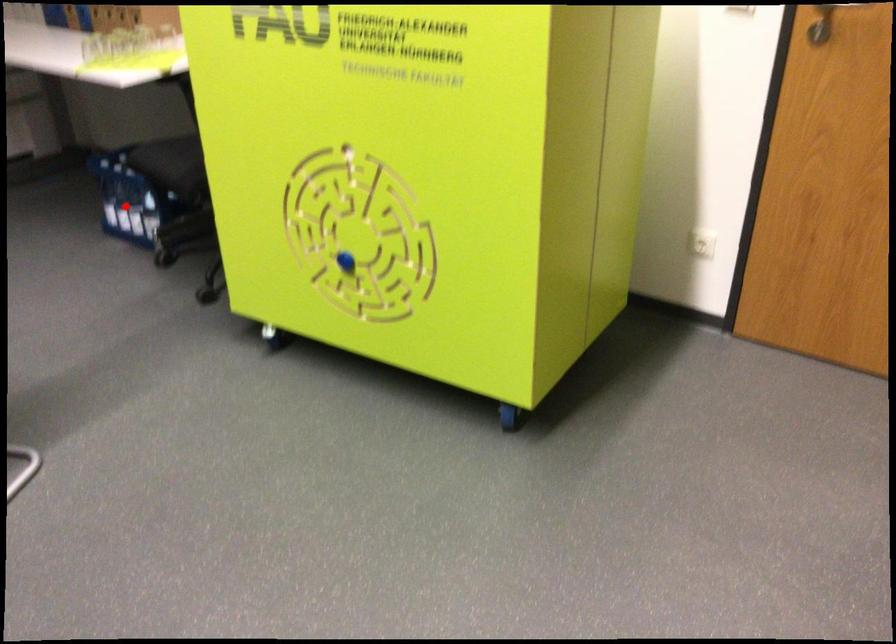
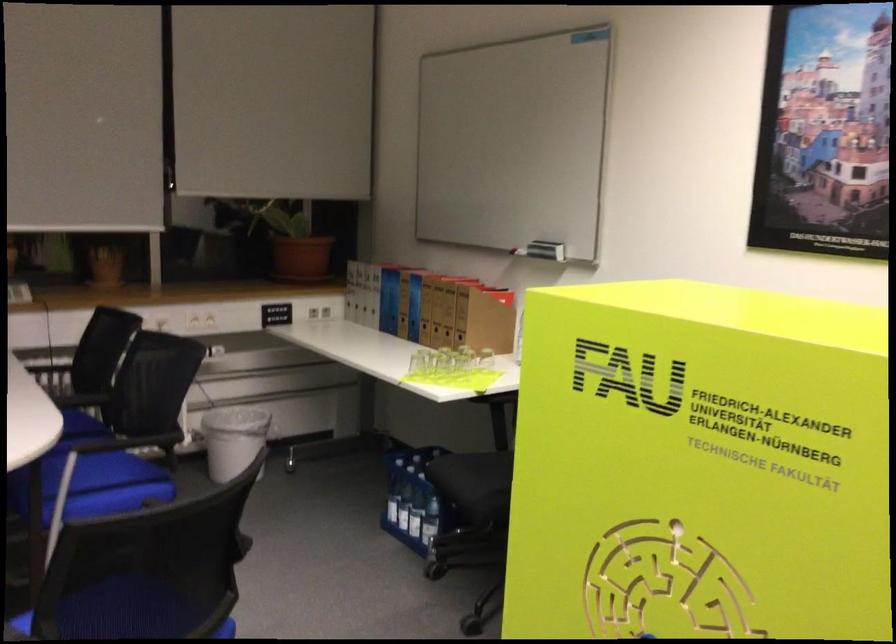
The point at the highlighted location is marked in the first image. Where is the corresponding point in the second image?

(403, 507)